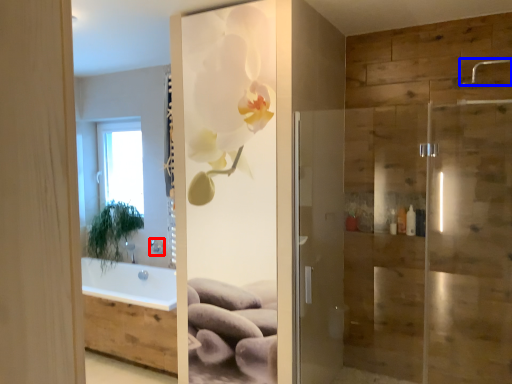
Question: Which object appears farthest to the camera in this image, shower (highlighted by a red box) or shower (highlighted by a blue box)?

Choices:
 (A) shower
 (B) shower

Answer: (A)